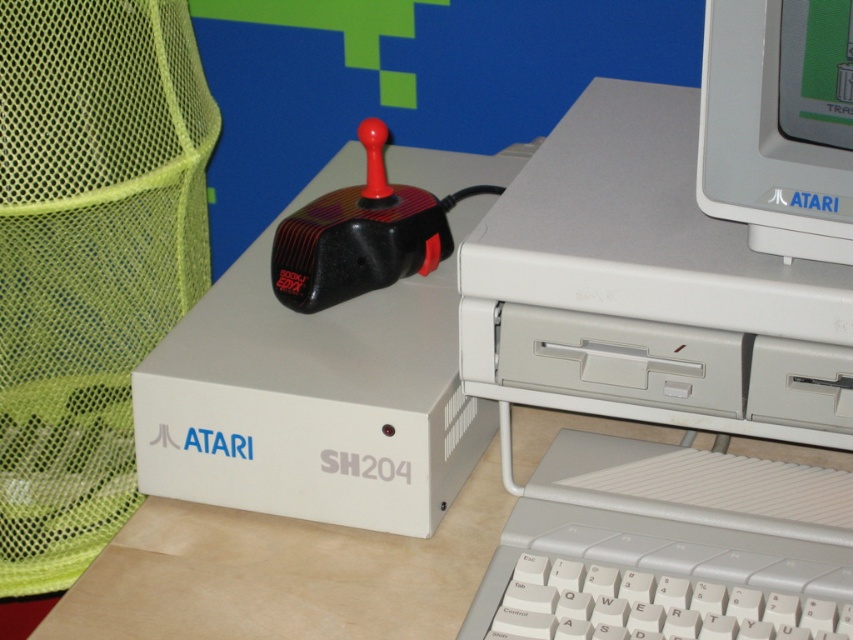
Question: Does white plastic computer at center appear under matte plastic monitor at upper right?

Choices:
 (A) no
 (B) yes

Answer: (B)

Question: Does white plastic computer at center have a smaller size compared to matte plastic monitor at upper right?

Choices:
 (A) yes
 (B) no

Answer: (B)

Question: Which object appears farthest from the camera in this image?

Choices:
 (A) matte plastic monitor at upper right
 (B) white plastic computer at center

Answer: (B)

Question: Does white plastic computer at center appear on the left side of matte plastic monitor at upper right?

Choices:
 (A) yes
 (B) no

Answer: (A)

Question: Which object is farther from the camera taking this photo?

Choices:
 (A) white plastic computer at center
 (B) matte plastic monitor at upper right

Answer: (A)